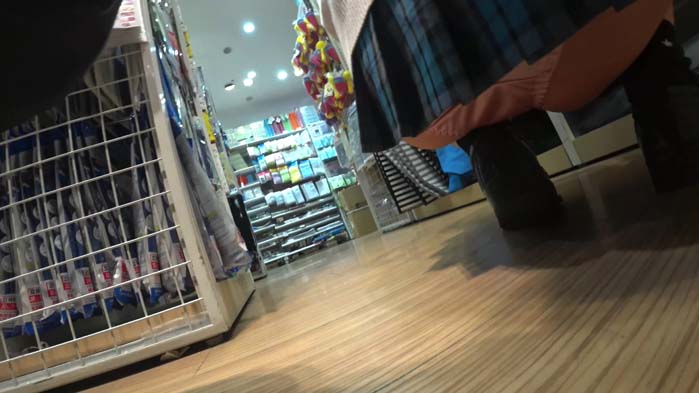
The width and height of the screenshot is (699, 393). I want to click on light, so click(245, 34).